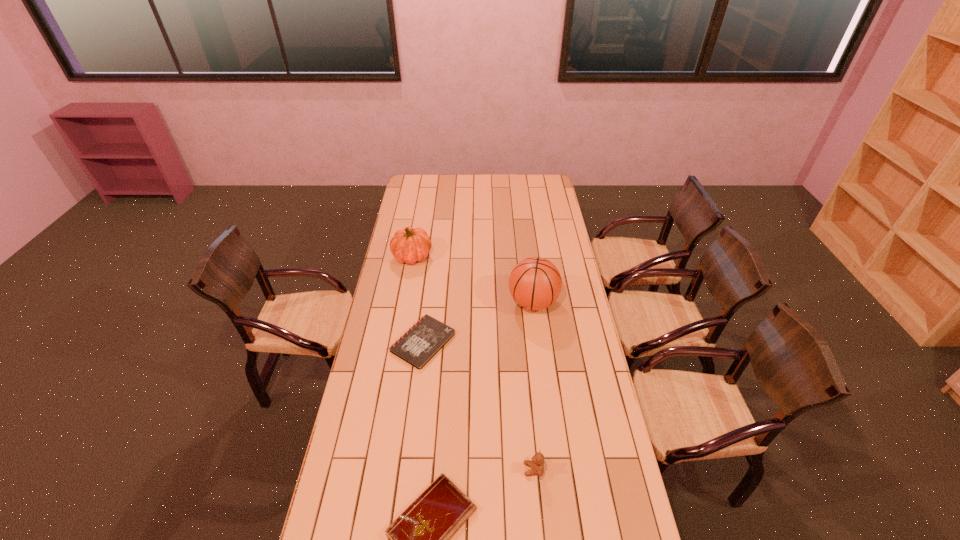
I want to click on basketball, so click(x=535, y=283).

This screenshot has height=540, width=960. Identify the location of pumpkin. (409, 245).

Identify the location of the second tallest object. Image resolution: width=960 pixels, height=540 pixels. (409, 245).

Find the location of a particular element. Image resolution: width=960 pixels, height=540 pixels. the third tallest object is located at coordinates (537, 464).

The height and width of the screenshot is (540, 960). In order to click on the farther notebook in this screenshot , I will do `click(418, 345)`.

Where is `vacant space situated on the back of the basketball`? The width and height of the screenshot is (960, 540). vacant space situated on the back of the basketball is located at coordinates (528, 259).

At what (x,y) coordinates should I click in order to perform the action: click on vacant space located 0.170m on the back of the farthest object. Please return your answer as a coordinate pair (x, y). Looking at the image, I should click on (418, 225).

Find the location of a particular element. This screenshot has height=540, width=960. vacant area situated on the face of the third tallest object is located at coordinates (502, 469).

The image size is (960, 540). I want to click on free space located on the face of the third tallest object, so click(x=404, y=469).

Where is `vacant position located 0.180m on the face of the third tallest object`? The height and width of the screenshot is (540, 960). vacant position located 0.180m on the face of the third tallest object is located at coordinates (468, 469).